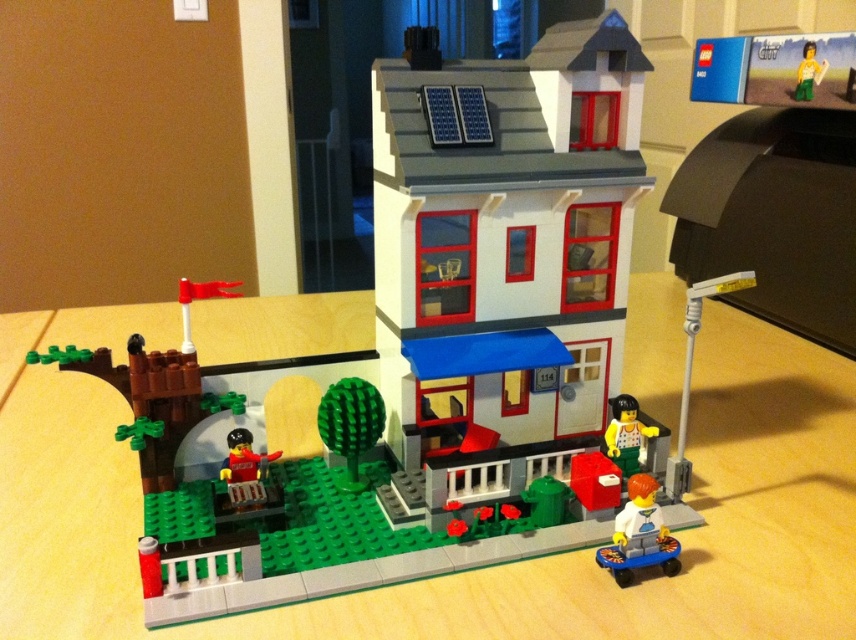
Question: Does matte red minifigure at lower left have a smaller size compared to light green plastic minifigure at lower right?

Choices:
 (A) no
 (B) yes

Answer: (A)

Question: Among these objects, which one is farthest from the camera?

Choices:
 (A) white matte minifigure at lower right
 (B) yellow matte figure at center

Answer: (B)

Question: Is matte red minifigure at lower left below light green plastic minifigure at lower right?

Choices:
 (A) yes
 (B) no

Answer: (A)

Question: Among these objects, which one is nearest to the camera?

Choices:
 (A) light green plastic minifigure at lower right
 (B) matte red minifigure at lower left
 (C) wooden table at center
 (D) white matte minifigure at lower right

Answer: (C)

Question: Which object is positioned farthest from the wooden table at center?

Choices:
 (A) light green plastic minifigure at lower right
 (B) matte red minifigure at lower left
 (C) yellow matte figure at center

Answer: (C)

Question: Is the position of wooden table at center more distant than that of white matte minifigure at lower right?

Choices:
 (A) yes
 (B) no

Answer: (B)